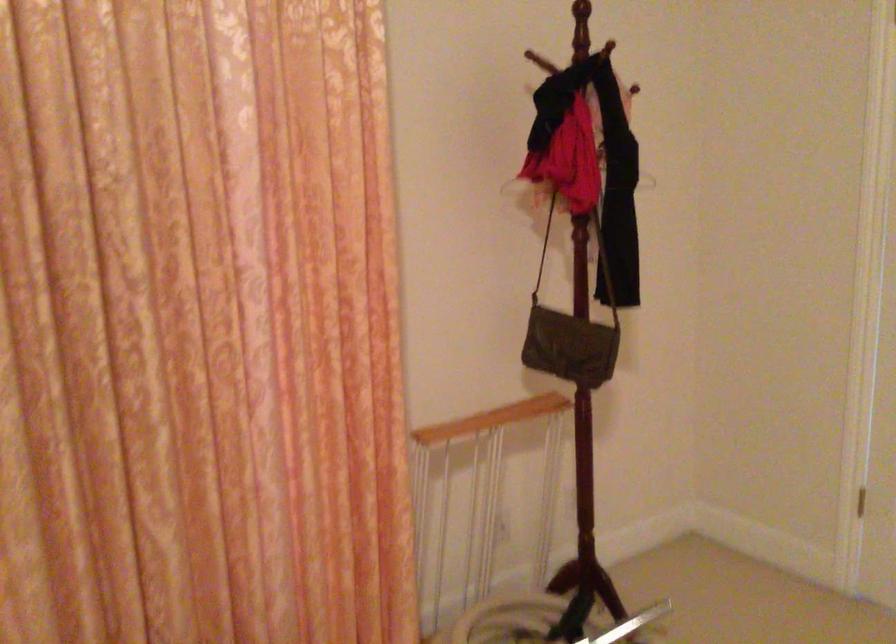
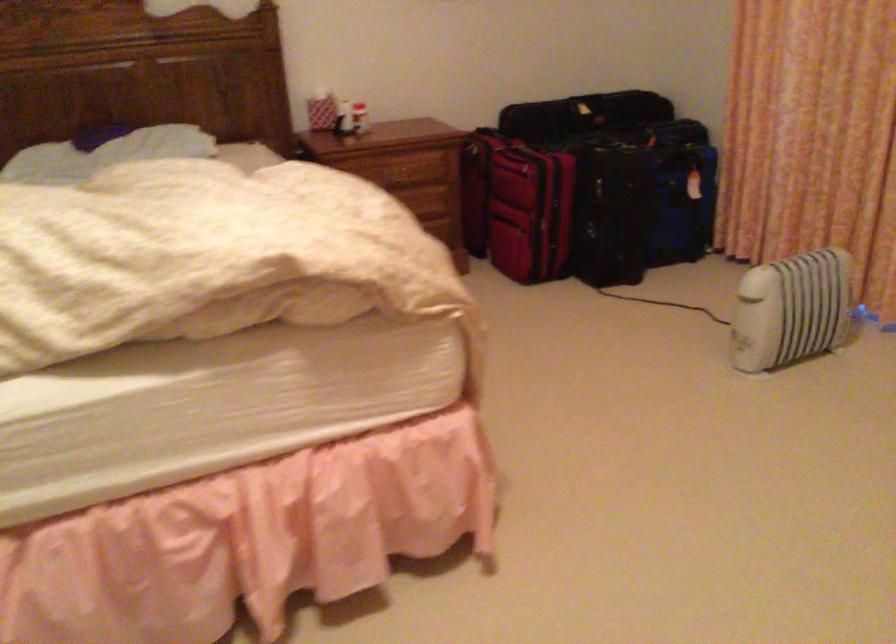
First-person continuous shooting, in which direction is the camera rotating?

The camera's rotation is toward left-down.